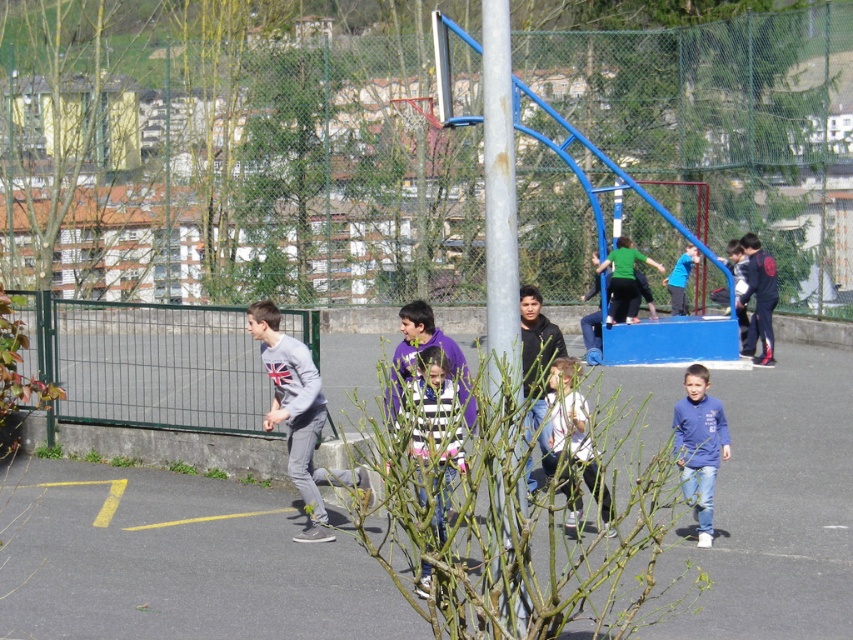
Question: Is gray cotton sweatshirt at center to the right of dark blue hoodie at center from the viewer's perspective?

Choices:
 (A) yes
 (B) no

Answer: (B)

Question: Among these objects, which one is nearest to the camera?

Choices:
 (A) striped fabric shirt at center
 (B) blue fleece jacket at center
 (C) gray cotton sweatshirt at center
 (D) black matte jacket at center

Answer: (D)

Question: Which point is closer to the camera taking this photo?

Choices:
 (A) (746, 353)
 (B) (311, 496)
 (C) (726, 440)

Answer: (C)

Question: Can you confirm if gray cotton sweatshirt at center is positioned to the right of white matte jacket at center?

Choices:
 (A) yes
 (B) no

Answer: (B)

Question: Which object is positioned closest to the blue fleece jacket at center?

Choices:
 (A) blue fleece jacket at upper center
 (B) gray cotton sweatshirt at center
 (C) black matte jacket at center
 (D) striped fabric shirt at center

Answer: (C)

Question: Is dark blue hoodie at center to the right of blue fleece jacket at upper center from the viewer's perspective?

Choices:
 (A) yes
 (B) no

Answer: (A)